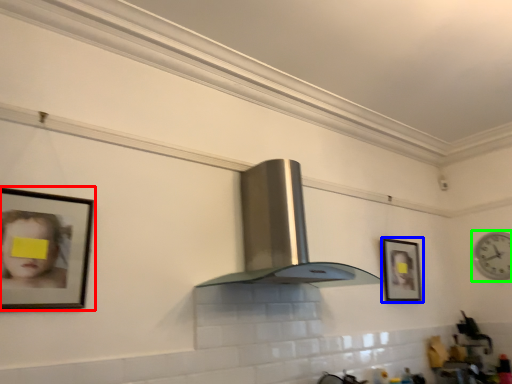
Question: Which is farther away from picture frame (highlighted by a red box)? picture frame (highlighted by a blue box) or clock (highlighted by a green box)?

Choices:
 (A) picture frame
 (B) clock

Answer: (B)